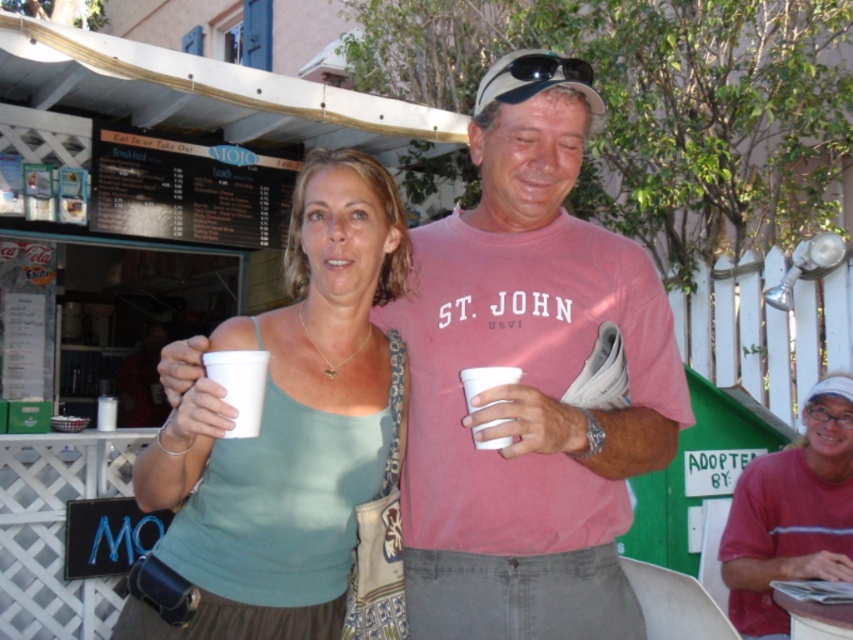
Is matte white cup at center smaller than matte green tank top at center?

Actually, matte white cup at center might be larger than matte green tank top at center.

The image size is (853, 640). What do you see at coordinates (287, 438) in the screenshot? I see `matte white cup at center` at bounding box center [287, 438].

Does point (276, 358) come closer to viewer compared to point (838, 576)?

Yes.

Image resolution: width=853 pixels, height=640 pixels. I want to click on matte white cup at center, so click(287, 438).

Between white paper cup at center and white styrofoam cup at center, which one is positioned lower?

Positioned lower is white styrofoam cup at center.

Is white paper cup at center below white styrofoam cup at center?

No, white paper cup at center is not below white styrofoam cup at center.

Is point (231, 381) farther from camera compared to point (477, 372)?

That is False.

Find the location of a particular element. The image size is (853, 640). white paper cup at center is located at coordinates (241, 385).

From the picture: Who is taller, matte green tank top at center or white styrofoam cup at center?

matte green tank top at center

Which is more to the right, matte green tank top at center or white styrofoam cup at center?

matte green tank top at center

The height and width of the screenshot is (640, 853). What are the coordinates of `matte green tank top at center` in the screenshot? It's located at (792, 515).

The image size is (853, 640). What are the coordinates of `matte green tank top at center` in the screenshot? It's located at (792, 515).